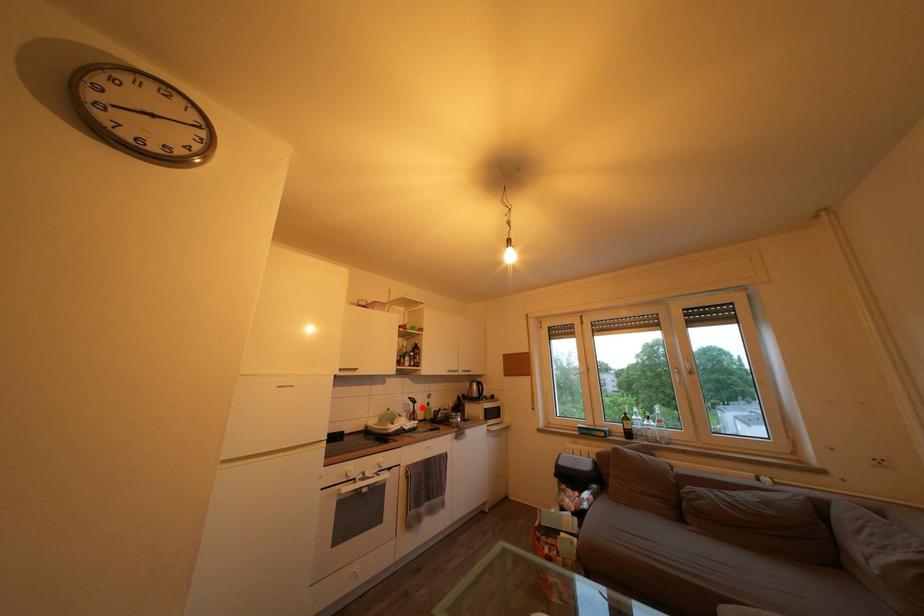
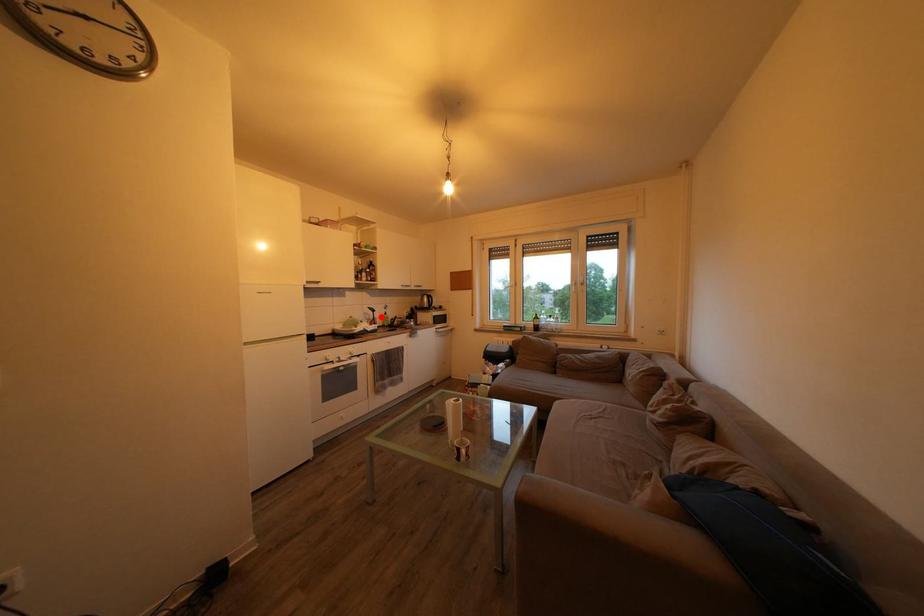
I am providing you with two images of the same scene from different viewpoints. A red point is marked on the first image and another point is marked on the second image. Is the red point in image1 aligned with the point shown in image2?

Yes